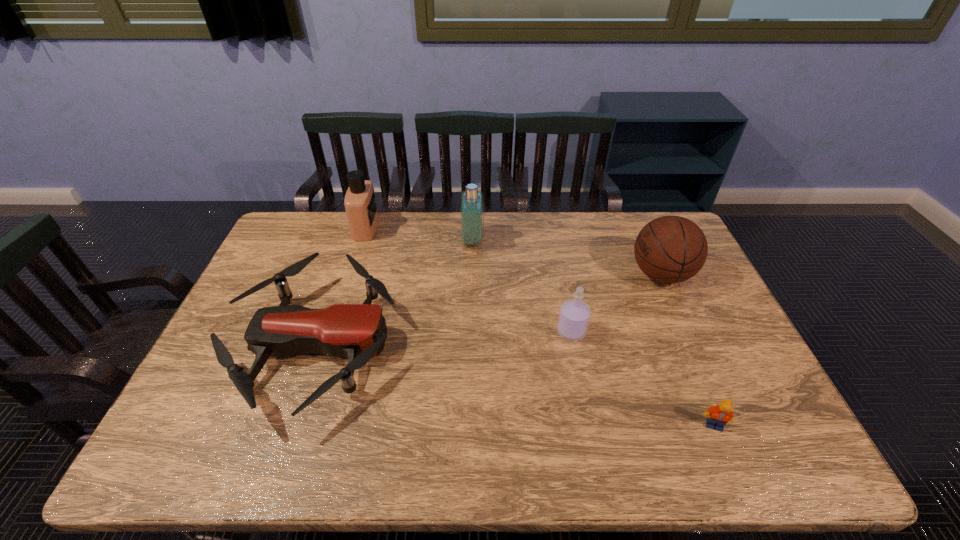
Locate an element on the screen. This screenshot has width=960, height=540. perfume that is the second closest to the Lego is located at coordinates (471, 204).

At what (x,y) coordinates should I click in order to perform the action: click on free space that satisfies the following two spatial constraints: 1. on the back side of the rightmost perfume; 2. on the front label of the leftmost perfume. Please return your answer as a coordinate pair (x, y). The width and height of the screenshot is (960, 540). Looking at the image, I should click on (551, 228).

The width and height of the screenshot is (960, 540). In order to click on vacant region that satisfies the following two spatial constraints: 1. on the front label of the fourth object from left to right; 2. on the right side of the leftmost perfume in this screenshot , I will do `click(334, 332)`.

This screenshot has height=540, width=960. I want to click on vacant region that satisfies the following two spatial constraints: 1. on the side with brand label of the basketball; 2. on the front-facing side of the Lego, so click(728, 426).

The height and width of the screenshot is (540, 960). What are the coordinates of `vacant region that satisfies the following two spatial constraints: 1. on the front label of the leftmost perfume; 2. on the right side of the nearest perfume` in the screenshot? It's located at (334, 332).